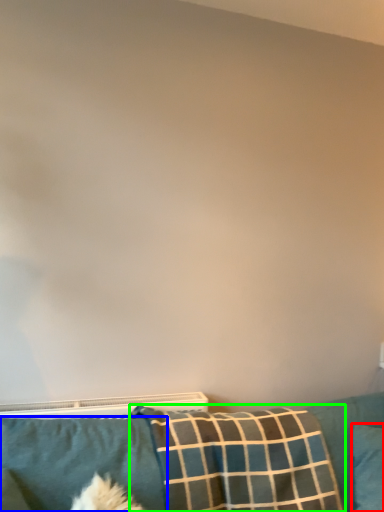
Question: Which is farther away from pillow (highlighted by a red box)? pillow (highlighted by a blue box) or pillow (highlighted by a green box)?

Choices:
 (A) pillow
 (B) pillow

Answer: (A)